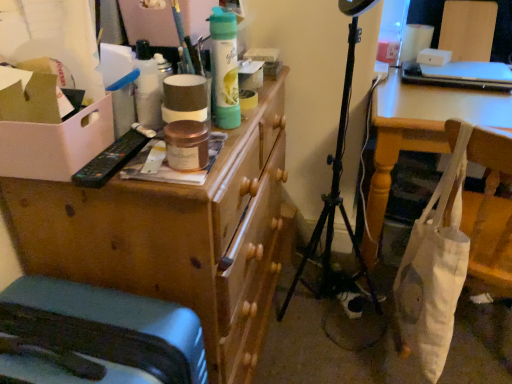
Question: Can you confirm if white canvas tote at lower right is wider than white cardboard box at left?

Choices:
 (A) no
 (B) yes

Answer: (A)

Question: Considering the relative positions of white canvas tote at lower right and white cardboard box at left in the image provided, is white canvas tote at lower right to the left of white cardboard box at left from the viewer's perspective?

Choices:
 (A) yes
 (B) no

Answer: (B)

Question: Does white canvas tote at lower right appear on the right side of white cardboard box at left?

Choices:
 (A) no
 (B) yes

Answer: (B)

Question: Considering the relative sizes of white canvas tote at lower right and white cardboard box at left in the image provided, is white canvas tote at lower right taller than white cardboard box at left?

Choices:
 (A) yes
 (B) no

Answer: (A)

Question: Can you confirm if white canvas tote at lower right is thinner than white cardboard box at left?

Choices:
 (A) yes
 (B) no

Answer: (A)

Question: Does white canvas tote at lower right contain white cardboard box at left?

Choices:
 (A) yes
 (B) no

Answer: (B)

Question: Is white cardboard box at left facing away from white fabric bag at lower right?

Choices:
 (A) no
 (B) yes

Answer: (A)

Question: Is white cardboard box at left thinner than white fabric bag at lower right?

Choices:
 (A) yes
 (B) no

Answer: (A)

Question: Considering the relative sizes of white cardboard box at left and white fabric bag at lower right in the image provided, is white cardboard box at left smaller than white fabric bag at lower right?

Choices:
 (A) no
 (B) yes

Answer: (B)

Question: Does white cardboard box at left contain white fabric bag at lower right?

Choices:
 (A) yes
 (B) no

Answer: (B)

Question: From the image's perspective, would you say white cardboard box at left is positioned over white fabric bag at lower right?

Choices:
 (A) no
 (B) yes

Answer: (B)

Question: Could you tell me if white cardboard box at left is turned towards white fabric bag at lower right?

Choices:
 (A) no
 (B) yes

Answer: (A)

Question: Is matte gray suitcase at lower left with wooden chest of drawers at upper left?

Choices:
 (A) no
 (B) yes

Answer: (A)